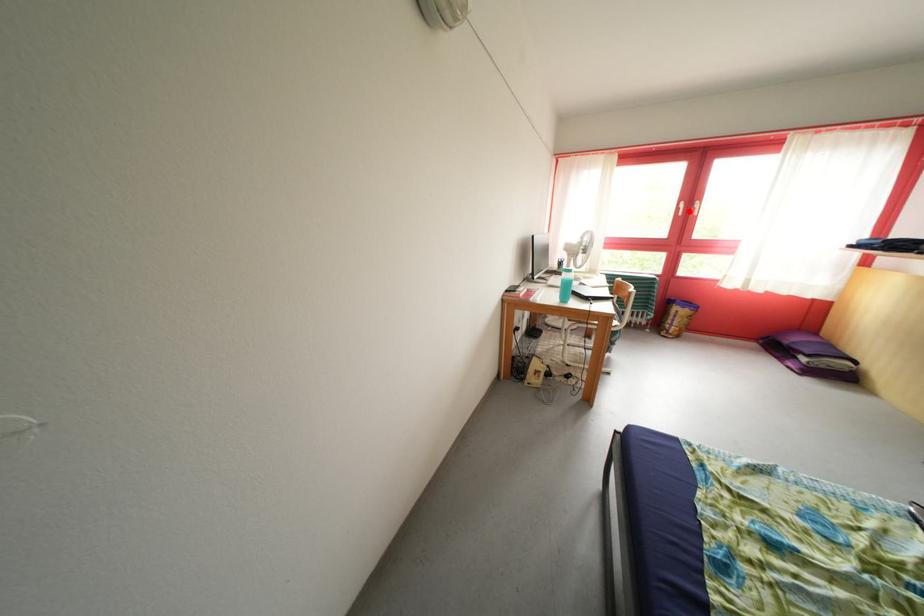
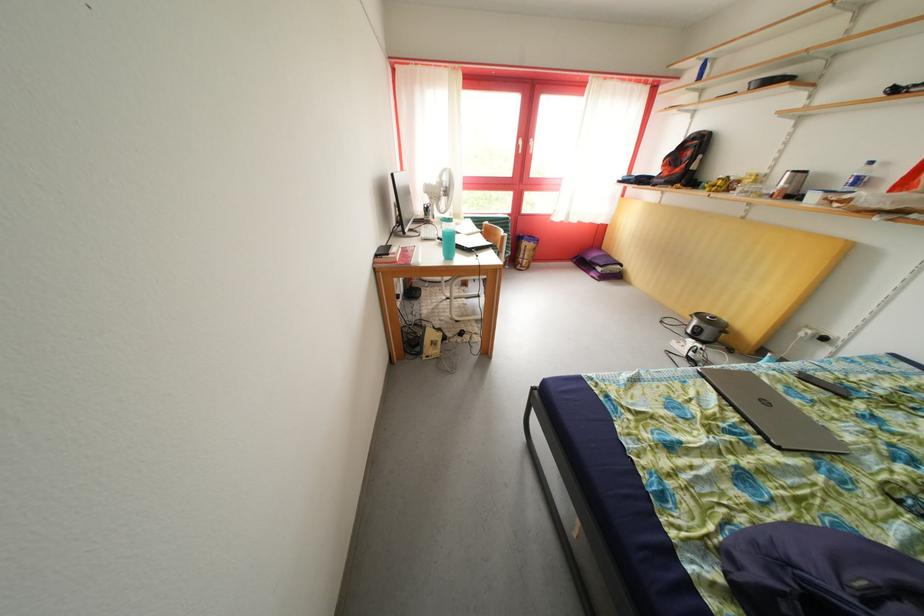
Question: A red point is marked in image1. In image2, is the corresponding 3D point closer to the camera or farther? Reply with the corresponding letter.

Choices:
 (A) The corresponding 3D point is closer.
 (B) The corresponding 3D point is farther.

Answer: (A)